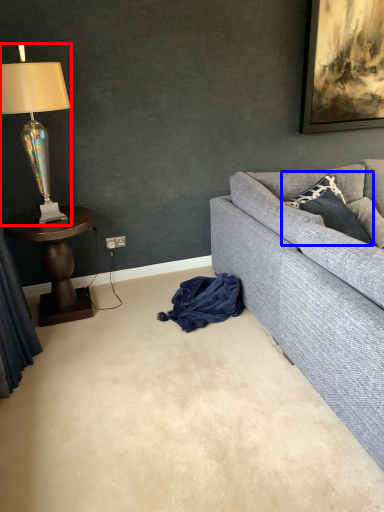
Question: Which of the following is the farthest to the observer, lamp (highlighted by a red box) or pillow (highlighted by a blue box)?

Choices:
 (A) lamp
 (B) pillow

Answer: (B)